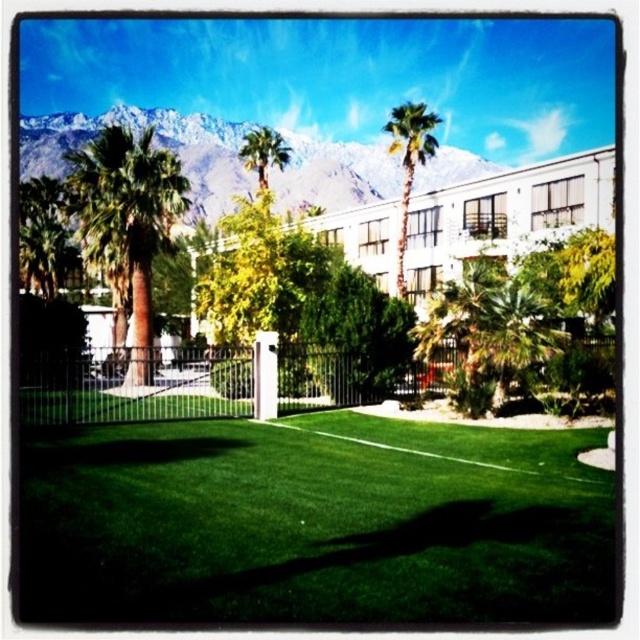
Question: Estimate the real-world distances between objects in this image. Which object is farther from the green leafy palm tree at upper center?

Choices:
 (A) brown textured palm tree at left
 (B) green leafy palm tree at center

Answer: (A)

Question: From the image, what is the correct spatial relationship of white glossy building at center in relation to green leafy palm tree at upper center?

Choices:
 (A) right
 (B) left

Answer: (B)

Question: Does white metal fence at center have a larger size compared to green leafy palm tree at upper center?

Choices:
 (A) no
 (B) yes

Answer: (A)

Question: Which of the following is the farthest from the observer?

Choices:
 (A) brown textured palm tree at left
 (B) green leafy palm tree at center

Answer: (B)

Question: Which object is positioned closest to the white glossy building at center?

Choices:
 (A) snowy white mountain at upper center
 (B) green leafy palm tree at center
 (C) brown textured palm tree at left

Answer: (C)

Question: Is white metal fence at center positioned before snowy white mountain at upper center?

Choices:
 (A) yes
 (B) no

Answer: (A)